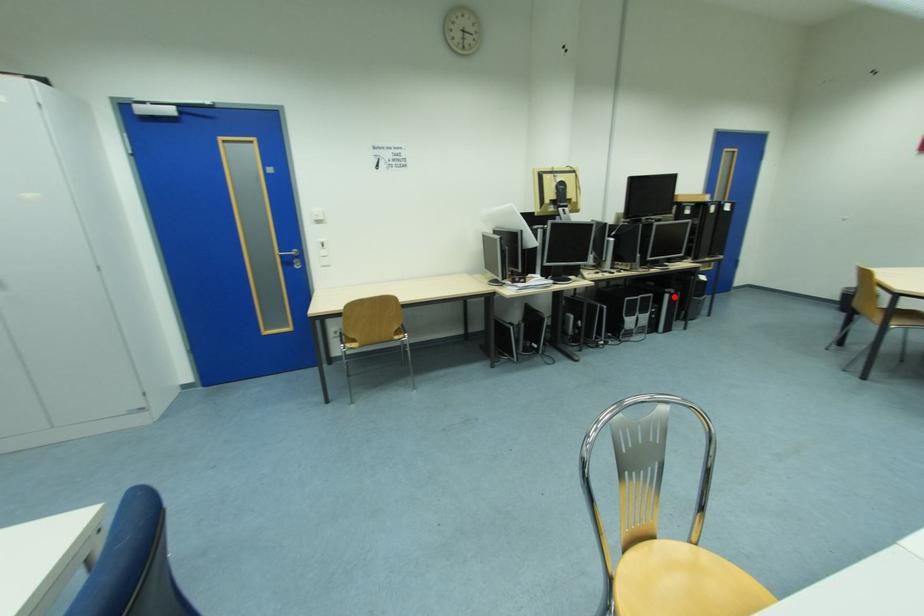
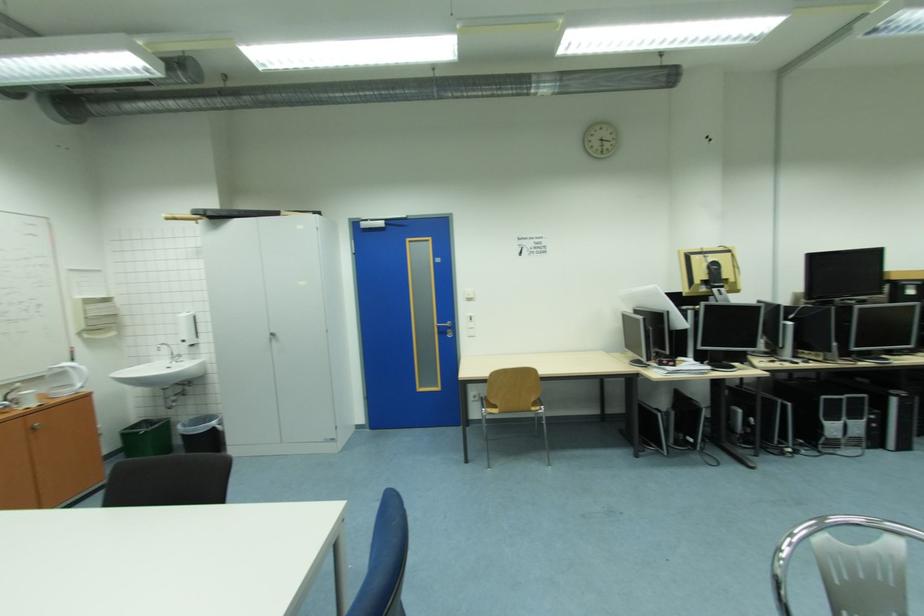
In the second image, find the point that corresponds to the highlighted location in the first image.

(901, 400)